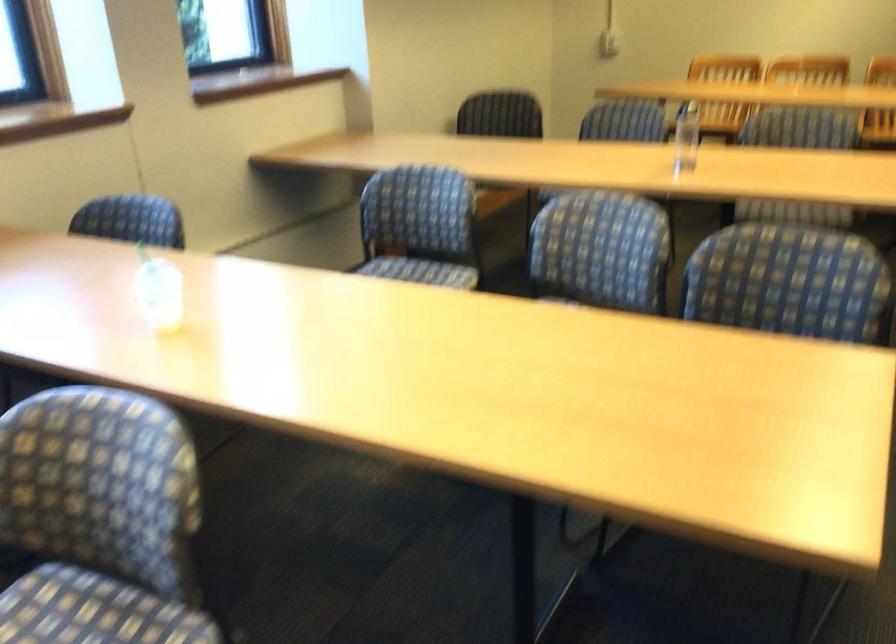
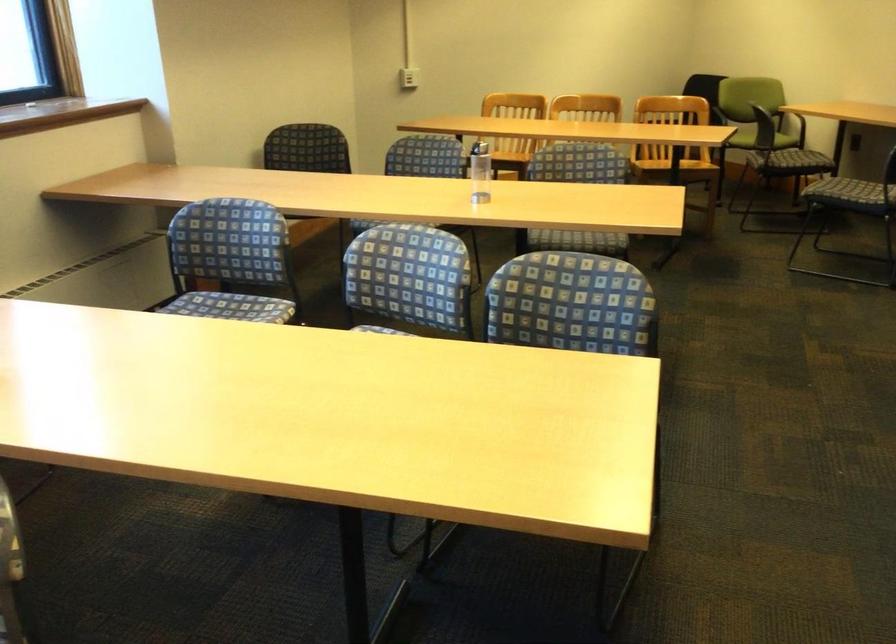
Question: In a continuous first-person perspective shot, in which direction is the camera moving?

Choices:
 (A) Left
 (B) Right
 (C) Forward
 (D) Backward

Answer: (D)